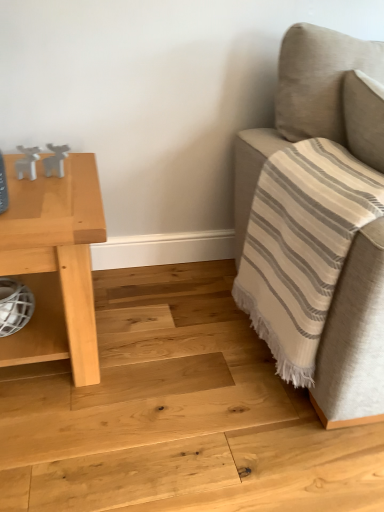
At what (x,y) coordinates should I click in order to perform the action: click on vacant area in front of light wood table at left. Please return your answer as a coordinate pair (x, y). This screenshot has width=384, height=512. Looking at the image, I should click on (76, 449).